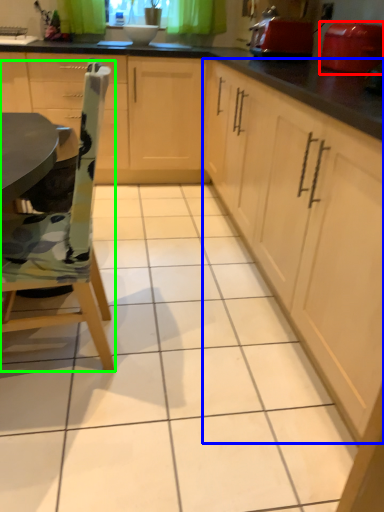
Question: Considering the real-world distances, which object is farthest from appliance (highlighted by a red box)? cabinetry (highlighted by a blue box) or chair (highlighted by a green box)?

Choices:
 (A) cabinetry
 (B) chair

Answer: (B)